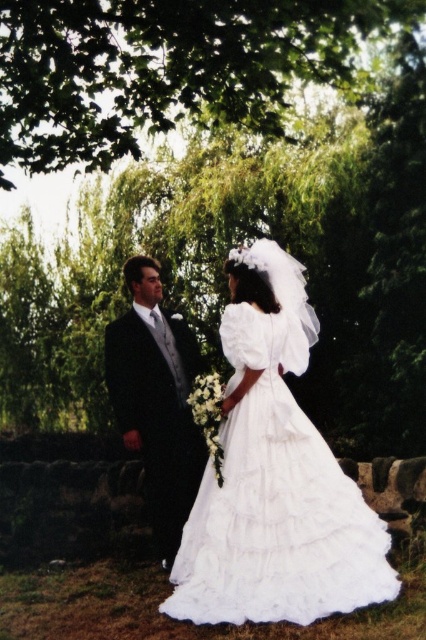
Question: Is green leafy tree at upper center positioned before shiny black suit at left?

Choices:
 (A) no
 (B) yes

Answer: (A)

Question: Which point appears closest to the camera in this image?

Choices:
 (A) (134, 298)
 (B) (236, 20)

Answer: (B)

Question: Does green leafy tree at upper center appear on the right side of shiny black suit at left?

Choices:
 (A) no
 (B) yes

Answer: (B)

Question: Considering the real-world distances, which object is farthest from the green leafy tree at upper center?

Choices:
 (A) white satin dress at center
 (B) shiny black suit at left

Answer: (A)

Question: Does white satin dress at center have a lesser width compared to shiny black suit at left?

Choices:
 (A) yes
 (B) no

Answer: (B)

Question: Which point is closer to the camera taking this photo?

Choices:
 (A) (287, 408)
 (B) (124, 371)
 (C) (100, 97)

Answer: (A)